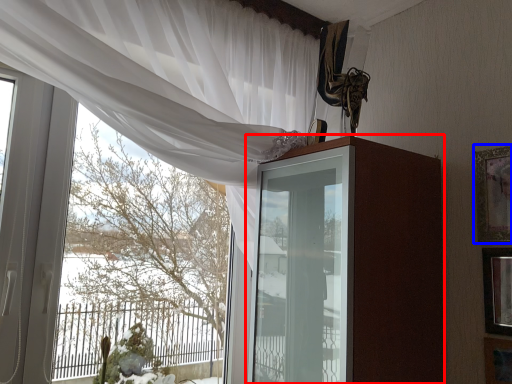
Question: Which object appears farthest to the camera in this image, dresser (highlighted by a red box) or picture frame (highlighted by a blue box)?

Choices:
 (A) dresser
 (B) picture frame

Answer: (B)